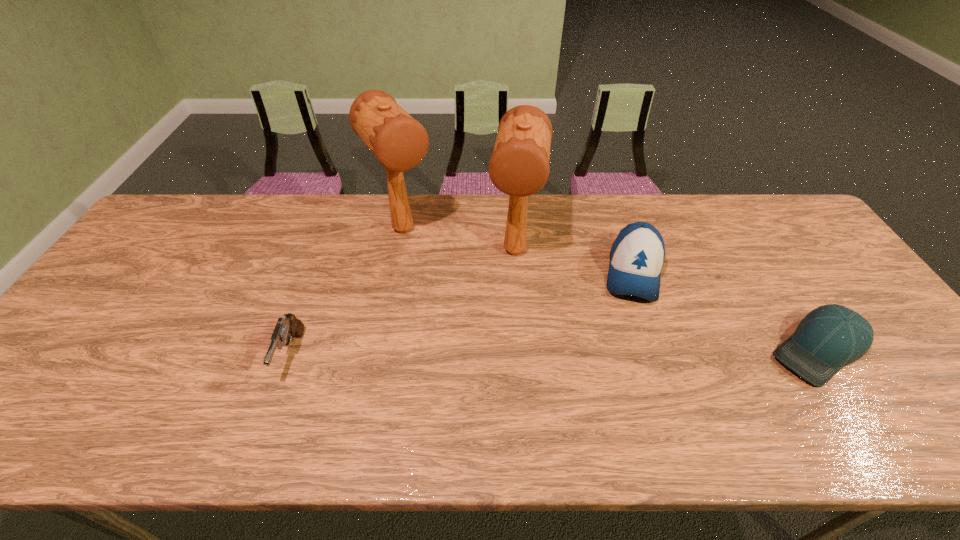
The width and height of the screenshot is (960, 540). What are the coordinates of `free space on the desktop that is between the pistol and the shorter baseball cap and is positioned on the front-facing side of the fourth object from left to right` in the screenshot? It's located at (628, 352).

This screenshot has width=960, height=540. What are the coordinates of `free space on the desktop that is between the pistol and the right baseball cap and is positioned on the strike surface of the second object from left to right` in the screenshot? It's located at (496, 353).

Image resolution: width=960 pixels, height=540 pixels. Identify the location of vacant space on the desktop that is between the second shortest object and the shorter baseball cap and is positioned on the strike surface of the third object from left to right. (500, 353).